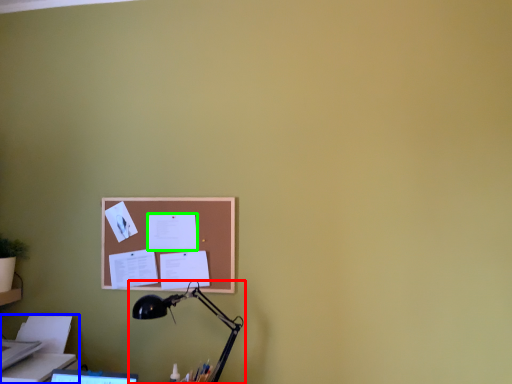
Question: Based on their relative distances, which object is nearer to lamp (highlighted by a red box)? Choose from printer (highlighted by a blue box) and paper (highlighted by a green box).

Choices:
 (A) printer
 (B) paper

Answer: (B)